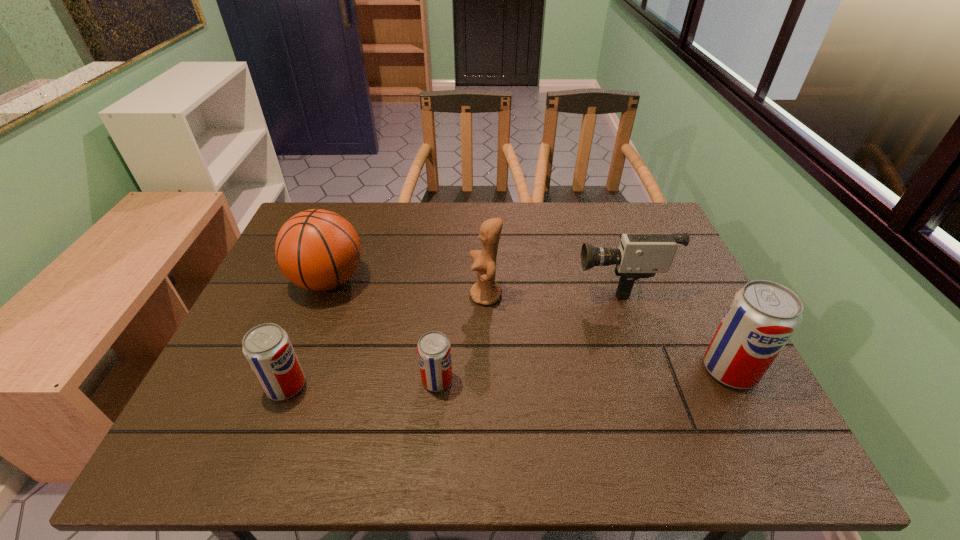
If the aim is uniform spacing by inserting an additional pop_(soda) among them, please point to a vacant space for this new pop_(soda). Please provide its 2D coordinates. Your answer should be formatted as a tuple, i.e. [(x, y)], where the tuple contains the x and y coordinates of a point satisfying the conditions above.

[(586, 375)]